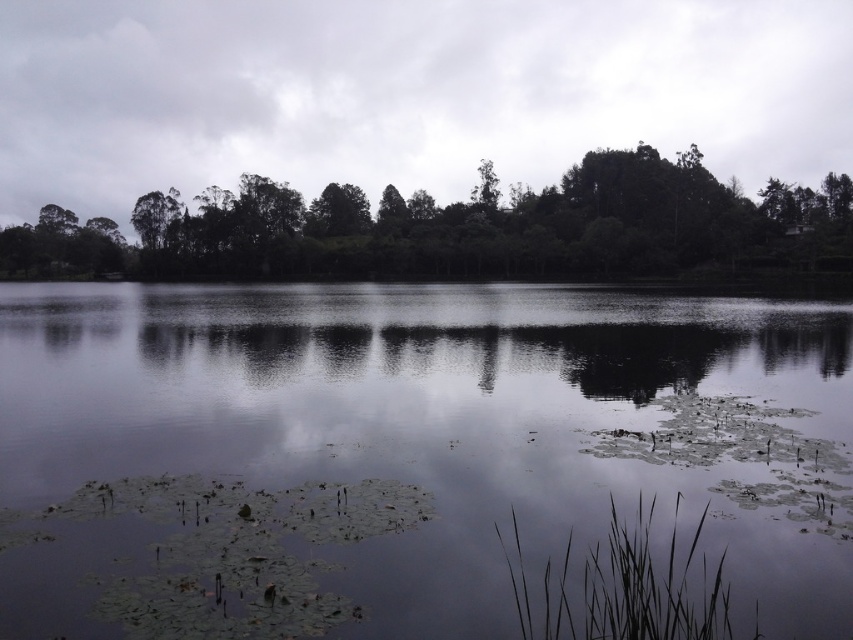
You are an environmental scientist observing the image. You need to determine the relationship between the transparent water at center and the green leafy trees at upper center. Which object is located above the other?

The green leafy trees at upper center are above the transparent water at center.

You are standing at the edge of a lake and see the transparent water at center and the green leafy trees at upper center. Which object is positioned to the right of the other?

The transparent water at center is to the right of green leafy trees at upper center.